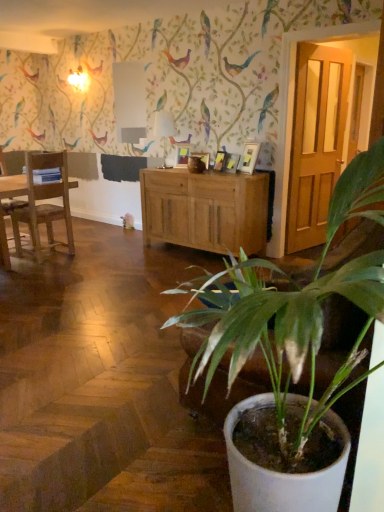
Question: From the image's perspective, is white glossy lampshade at center located above or below white glossy picture frame at upper center, arranged as the third picture frame when viewed from the left?

Choices:
 (A) above
 (B) below

Answer: (A)

Question: Considering the relative positions of white glossy lampshade at center and white glossy picture frame at upper center, the first picture frame from the right, in the image provided, is white glossy lampshade at center to the left or to the right of white glossy picture frame at upper center, the first picture frame from the right,?

Choices:
 (A) right
 (B) left

Answer: (B)

Question: Which of these objects is positioned closest to the white glossy picture frame at upper center, the first picture frame from the right?

Choices:
 (A) matte wooden picture frame at center, placed as the first picture frame when sorted from back to front
 (B) matte wooden door at right
 (C) light brown wood cabinet at center
 (D) white glossy lampshade at center
 (E) wooden chair at left, which is counted as the first chair, starting from the left

Answer: (C)

Question: Which of these objects is positioned farthest from the white glossy lampshade at center?

Choices:
 (A) matte wooden door at right
 (B) white matte plant pot at lower right
 (C) wooden chair at left, positioned as the second chair in left-to-right order
 (D) wooden chair at left, the 2th chair in the right-to-left sequence
 (E) matte wooden picture frame at center, arranged as the third picture frame when viewed from the right

Answer: (B)